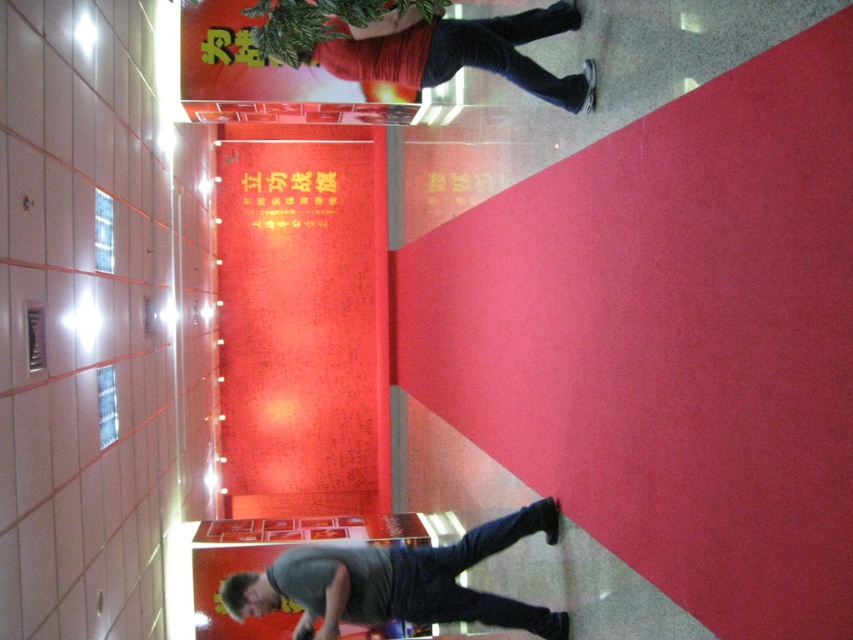
Question: Among these objects, which one is nearest to the camera?

Choices:
 (A) matte black pants at upper right
 (B) gray matte shirt at lower center

Answer: (A)

Question: In this image, where is matte black pants at upper right located relative to red paper sign at upper center?

Choices:
 (A) right
 (B) left

Answer: (A)

Question: Which object is farther from the camera taking this photo?

Choices:
 (A) gray matte shirt at lower center
 (B) matte black pants at upper right

Answer: (A)

Question: Is gray matte shirt at lower center to the left of matte black pants at upper right from the viewer's perspective?

Choices:
 (A) yes
 (B) no

Answer: (A)

Question: Is gray matte shirt at lower center further to the viewer compared to red paper sign at upper center?

Choices:
 (A) yes
 (B) no

Answer: (B)

Question: Among these points, which one is nearest to the camera?

Choices:
 (A) (451, 76)
 (B) (329, 195)

Answer: (A)